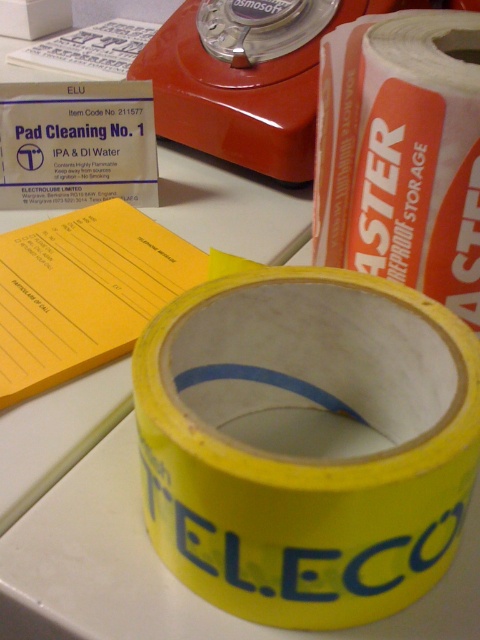
Based on the photo, how much distance is there between yellow matte adhesive tape at center and matte plastic stapler at upper center?

A distance of 49.02 centimeters exists between yellow matte adhesive tape at center and matte plastic stapler at upper center.

Can you confirm if yellow matte adhesive tape at center is thinner than matte plastic stapler at upper center?

Yes.

Identify the location of yellow matte adhesive tape at center. Image resolution: width=480 pixels, height=640 pixels. (307, 442).

Identify the location of yellow matte adhesive tape at center. The image size is (480, 640). click(307, 442).